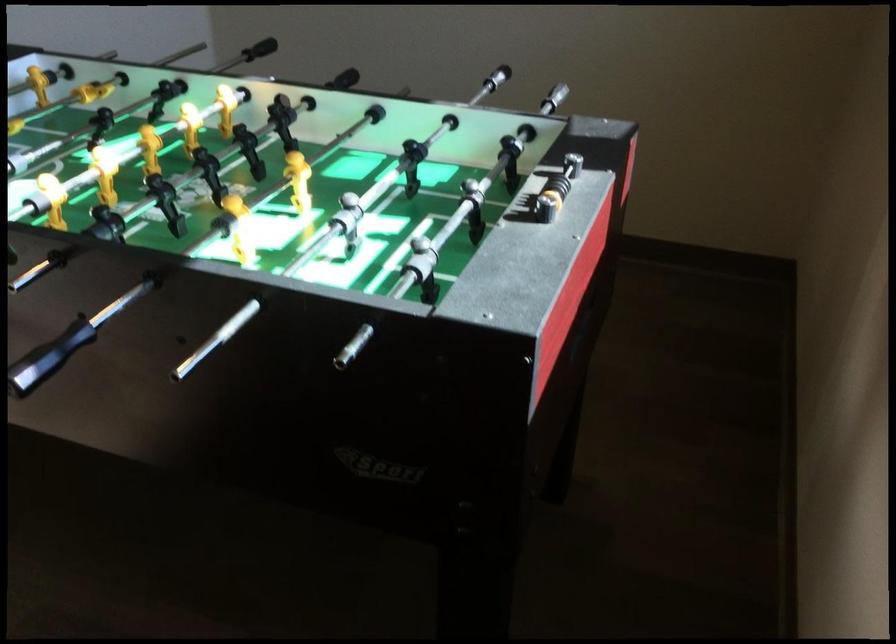
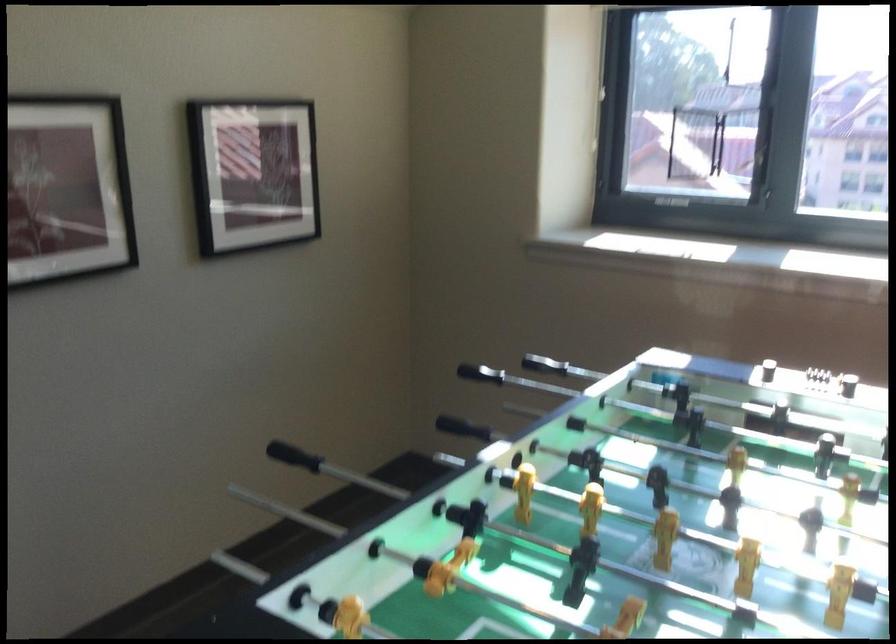
Locate, in the second image, the point that corresponds to (790,239) in the first image.

(463, 428)